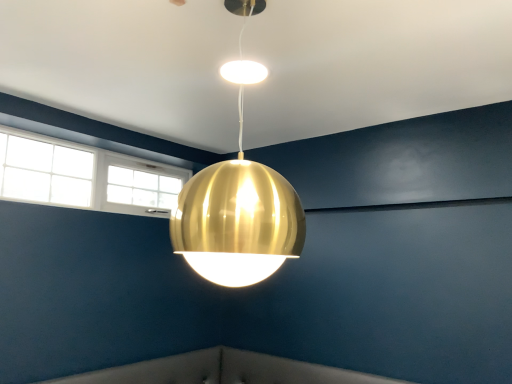
I want to click on white glass window at upper left, so click(x=84, y=176).

The height and width of the screenshot is (384, 512). Describe the element at coordinates (84, 176) in the screenshot. I see `white glass window at upper left` at that location.

Locate an element on the screen. This screenshot has width=512, height=384. gold metallic sphere at center is located at coordinates (238, 210).

What is the approximate height of gold metallic sphere at center?

The height of gold metallic sphere at center is 31.63 inches.

The width and height of the screenshot is (512, 384). What do you see at coordinates (238, 210) in the screenshot?
I see `gold metallic sphere at center` at bounding box center [238, 210].

The height and width of the screenshot is (384, 512). What are the coordinates of `white glass window at upper left` in the screenshot? It's located at (84, 176).

In the scene shown: Which object is positioned more to the right, gold metallic sphere at center or white glass window at upper left?

gold metallic sphere at center.

Does gold metallic sphere at center come in front of white glass window at upper left?

Yes, gold metallic sphere at center is in front of white glass window at upper left.

Which is behind, point (197, 244) or point (99, 206)?

The point (99, 206) is farther from the camera.

From the picture: From the image's perspective, which is above, gold metallic sphere at center or white glass window at upper left?

gold metallic sphere at center.

From a real-world perspective, which object stands above the other?

white glass window at upper left is physically above.

Is gold metallic sphere at center thinner than white glass window at upper left?

Incorrect, the width of gold metallic sphere at center is not less than that of white glass window at upper left.

Between gold metallic sphere at center and white glass window at upper left, which one has less height?

white glass window at upper left is shorter.

From the picture: Considering the relative sizes of gold metallic sphere at center and white glass window at upper left in the image provided, is gold metallic sphere at center smaller than white glass window at upper left?

Actually, gold metallic sphere at center might be larger than white glass window at upper left.

Is gold metallic sphere at center spatially inside white glass window at upper left, or outside of it?

gold metallic sphere at center exists outside the volume of white glass window at upper left.

Are gold metallic sphere at center and white glass window at upper left located far from each other?

That's right, there is a large distance between gold metallic sphere at center and white glass window at upper left.

Is gold metallic sphere at center aimed at white glass window at upper left?

No.

Identify the location of lamp on the right side of white glass window at upper left. The width and height of the screenshot is (512, 384). (238, 210).

Considering the positions of objects white glass window at upper left and gold metallic sphere at center in the image provided, who is more to the right, white glass window at upper left or gold metallic sphere at center?

gold metallic sphere at center is more to the right.

Considering the positions of objects white glass window at upper left and gold metallic sphere at center in the image provided, who is in front, white glass window at upper left or gold metallic sphere at center?

gold metallic sphere at center is more forward.

Which point is more distant from viewer, (19, 190) or (270, 235)?

The point (19, 190) is farther from the camera.

From the image's perspective, relative to gold metallic sphere at center, is white glass window at upper left above or below?

Clearly, from the image's perspective, white glass window at upper left is below gold metallic sphere at center.

From a real-world perspective, is white glass window at upper left below gold metallic sphere at center?

No, from a real-world perspective, white glass window at upper left is not under gold metallic sphere at center.

Is white glass window at upper left thinner than gold metallic sphere at center?

Correct, the width of white glass window at upper left is less than that of gold metallic sphere at center.

In terms of height, does white glass window at upper left look taller or shorter compared to gold metallic sphere at center?

Clearly, white glass window at upper left is shorter compared to gold metallic sphere at center.

Is white glass window at upper left bigger or smaller than gold metallic sphere at center?

Clearly, white glass window at upper left is smaller in size than gold metallic sphere at center.

Is white glass window at upper left situated inside gold metallic sphere at center or outside?

white glass window at upper left is located beyond the bounds of gold metallic sphere at center.

Looking at this image, is white glass window at upper left far from gold metallic sphere at center?

white glass window at upper left is positioned a significant distance from gold metallic sphere at center.

Is gold metallic sphere at center at the back of white glass window at upper left?

No, gold metallic sphere at center is not at the back of white glass window at upper left.

What's the angular difference between white glass window at upper left and gold metallic sphere at center's facing directions?

The angle between the facing direction of white glass window at upper left and the facing direction of gold metallic sphere at center is 0.871 degrees.

How much distance is there between white glass window at upper left and gold metallic sphere at center?

white glass window at upper left and gold metallic sphere at center are 1.67 meters apart.

You are a GUI agent. You are given a task and a screenshot of the screen. Output one action in this format:
    pyautogui.click(x=<x>, y=<y>)
    Task: Click on the lamp on the right of white glass window at upper left
    The image size is (512, 384).
    Given the screenshot: What is the action you would take?
    pyautogui.click(x=238, y=210)

Where is `lamp on the right of white glass window at upper left`? Image resolution: width=512 pixels, height=384 pixels. lamp on the right of white glass window at upper left is located at coordinates (238, 210).

Identify the location of window behind the gold metallic sphere at center. The width and height of the screenshot is (512, 384). (84, 176).